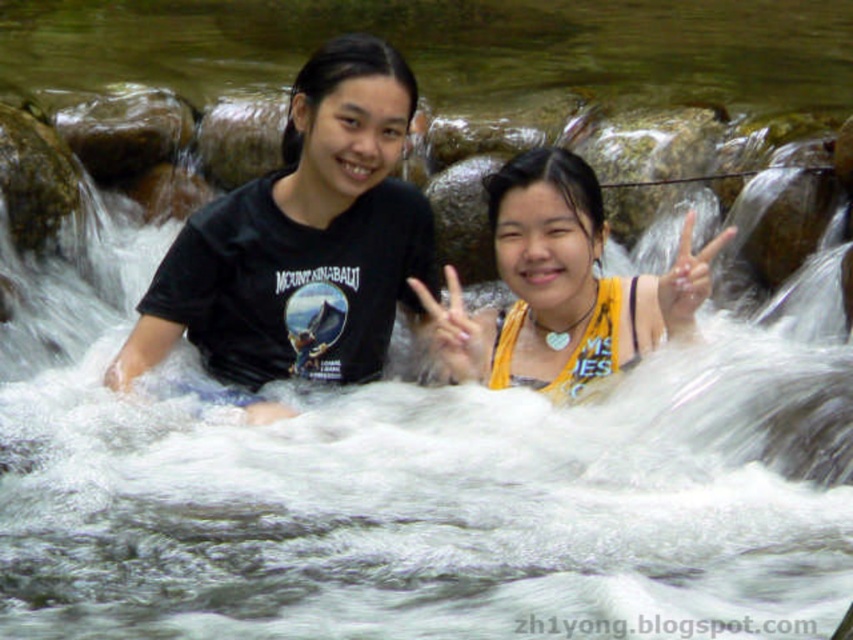
In the scene shown: Can you confirm if black matte t-shirt at center is positioned to the left of yellow fabric at center?

Indeed, black matte t-shirt at center is positioned on the left side of yellow fabric at center.

Which is below, black matte t-shirt at center or yellow fabric at center?

yellow fabric at center

Which is behind, point (297, 84) or point (619, 317)?

Point (297, 84)

I want to click on black matte t-shirt at center, so click(302, 241).